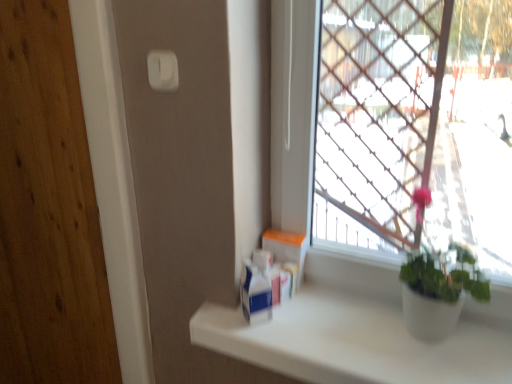
Question: Is white cardboard box at center in front of or behind white plastic container at center in the image?

Choices:
 (A) behind
 (B) front

Answer: (B)

Question: From the image's perspective, is white cardboard box at center positioned above or below white plastic container at center?

Choices:
 (A) below
 (B) above

Answer: (B)

Question: Which of these objects is positioned closest to the white cardboard box at center?

Choices:
 (A) white matte counter top at lower right
 (B) white plastic light switch at upper center
 (C) white plastic container at center

Answer: (C)

Question: Which of these objects is positioned farthest from the white plastic container at center?

Choices:
 (A) white plastic light switch at upper center
 (B) white matte counter top at lower right
 (C) white cardboard box at center

Answer: (A)